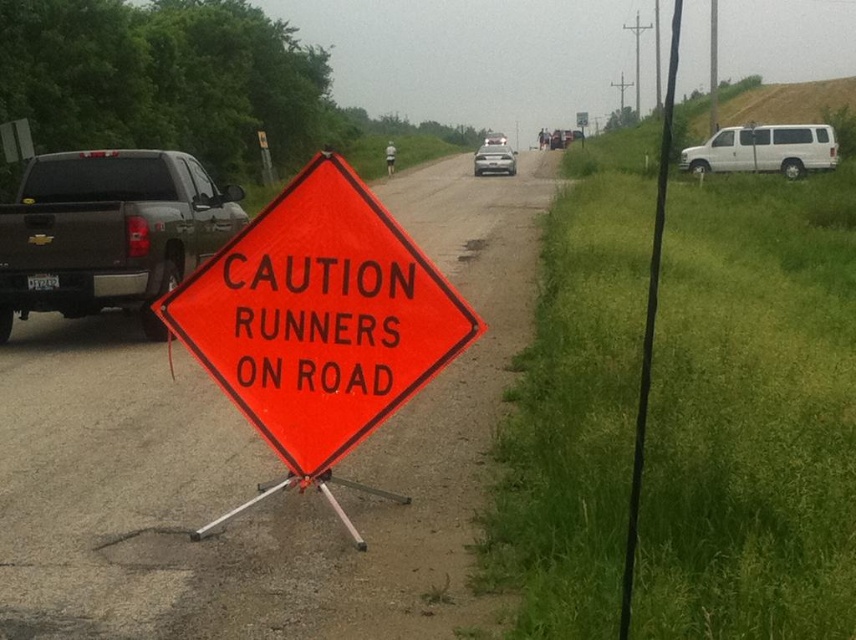
Question: Which of the following is the closest to the observer?

Choices:
 (A) orange diamond-shaped sign at center
 (B) white matte van at right

Answer: (A)

Question: Is white matte van at right further to camera compared to silver metallic sedan at center?

Choices:
 (A) yes
 (B) no

Answer: (B)

Question: Which point appears closest to the camera in this image?

Choices:
 (A) (776, 124)
 (B) (509, 163)
 (C) (417, 305)

Answer: (C)

Question: Observing the image, what is the correct spatial positioning of orange diamond-shaped sign at center in reference to white matte van at right?

Choices:
 (A) below
 (B) above

Answer: (A)

Question: Which of the following is the farthest from the observer?

Choices:
 (A) matte black truck at left
 (B) white matte van at right

Answer: (B)

Question: Can you confirm if orange diamond-shaped sign at center is smaller than matte black truck at left?

Choices:
 (A) yes
 (B) no

Answer: (A)